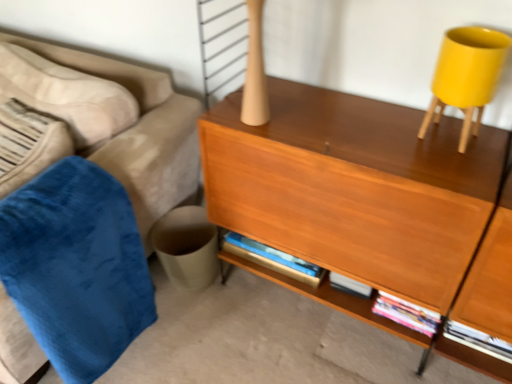
Question: Is wooden desk at center not close to velvet blue blanket at left?

Choices:
 (A) no
 (B) yes

Answer: (A)

Question: Is wooden desk at center taller than velvet blue blanket at left?

Choices:
 (A) no
 (B) yes

Answer: (B)

Question: From a real-world perspective, is wooden desk at center under velvet blue blanket at left?

Choices:
 (A) no
 (B) yes

Answer: (A)

Question: Does wooden desk at center come behind velvet blue blanket at left?

Choices:
 (A) no
 (B) yes

Answer: (A)

Question: Is wooden desk at center next to velvet blue blanket at left?

Choices:
 (A) no
 (B) yes

Answer: (A)

Question: Is velvet blue blanket at left bigger or smaller than wooden desk at center?

Choices:
 (A) small
 (B) big

Answer: (A)

Question: Considering the positions of point (64, 359) and point (348, 195), is point (64, 359) closer or farther from the camera than point (348, 195)?

Choices:
 (A) closer
 (B) farther

Answer: (B)

Question: Based on their positions, is velvet blue blanket at left located to the left or right of wooden desk at center?

Choices:
 (A) right
 (B) left

Answer: (B)

Question: From the image's perspective, is velvet blue blanket at left above or below wooden desk at center?

Choices:
 (A) below
 (B) above

Answer: (A)

Question: From a real-world perspective, is matte yellow plastic swivel chair at upper right above or below velvet blue couch at left?

Choices:
 (A) below
 (B) above

Answer: (B)

Question: Considering the positions of matte yellow plastic swivel chair at upper right and velvet blue couch at left in the image, is matte yellow plastic swivel chair at upper right taller or shorter than velvet blue couch at left?

Choices:
 (A) tall
 (B) short

Answer: (B)

Question: In terms of width, does matte yellow plastic swivel chair at upper right look wider or thinner when compared to velvet blue couch at left?

Choices:
 (A) thin
 (B) wide

Answer: (A)

Question: Is matte yellow plastic swivel chair at upper right inside the boundaries of velvet blue couch at left, or outside?

Choices:
 (A) inside
 (B) outside

Answer: (B)

Question: Is velvet blue couch at left situated inside matte yellow plastic swivel chair at upper right or outside?

Choices:
 (A) outside
 (B) inside

Answer: (A)

Question: Considering the positions of velvet blue couch at left and matte yellow plastic swivel chair at upper right in the image, is velvet blue couch at left taller or shorter than matte yellow plastic swivel chair at upper right?

Choices:
 (A) short
 (B) tall

Answer: (B)